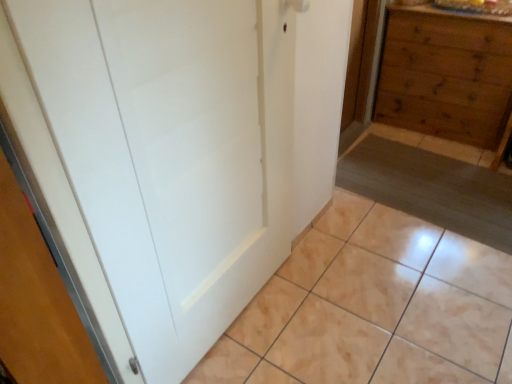
Identify the location of beige glossy tile at lower center. The height and width of the screenshot is (384, 512). (372, 307).

Consider the image. Considering the relative sizes of white matte door at center and beige glossy tile at lower center in the image provided, is white matte door at center thinner than beige glossy tile at lower center?

Indeed, white matte door at center has a lesser width compared to beige glossy tile at lower center.

Is point (197, 313) closer or farther from the camera than point (404, 229)?

Point (197, 313).

Looking at this image, is white matte door at center at the right side of beige glossy tile at lower center?

No.

Is white matte door at center oriented towards beige glossy tile at lower center?

No, white matte door at center is not aimed at beige glossy tile at lower center.

From a real-world perspective, between beige glossy tile at lower center and wooden chest of drawers at right, who is vertically lower?

beige glossy tile at lower center.

Can you confirm if beige glossy tile at lower center is taller than wooden chest of drawers at right?

In fact, beige glossy tile at lower center may be shorter than wooden chest of drawers at right.

Does beige glossy tile at lower center lie in front of wooden chest of drawers at right?

Yes, it is.

Considering the positions of objects beige glossy tile at lower center and wooden chest of drawers at right in the image provided, who is more to the right, beige glossy tile at lower center or wooden chest of drawers at right?

wooden chest of drawers at right.

How different are the orientations of beige glossy tile at lower center and white matte door at center in degrees?

beige glossy tile at lower center and white matte door at center are facing 89 degrees away from each other.

Identify the location of door that is above the beige glossy tile at lower center (from a real-world perspective). This screenshot has width=512, height=384. (174, 154).

Looking at the image, does beige glossy tile at lower center seem bigger or smaller compared to white matte door at center?

beige glossy tile at lower center is bigger than white matte door at center.

Is beige glossy tile at lower center completely or partially outside of white matte door at center?

Yes.

Considering the relative sizes of wooden chest of drawers at right and white matte door at center in the image provided, is wooden chest of drawers at right bigger than white matte door at center?

Correct, wooden chest of drawers at right is larger in size than white matte door at center.

Considering the relative sizes of wooden chest of drawers at right and white matte door at center in the image provided, is wooden chest of drawers at right thinner than white matte door at center?

No, wooden chest of drawers at right is not thinner than white matte door at center.

From their relative heights in the image, would you say wooden chest of drawers at right is taller or shorter than white matte door at center?

A: Considering their sizes, wooden chest of drawers at right has less height than white matte door at center.

Which is behind, point (455, 112) or point (270, 175)?

The point (455, 112) is behind.

From the image's perspective, is white matte door at center above or below wooden chest of drawers at right?

Based on their image positions, white matte door at center is located beneath wooden chest of drawers at right.

From the picture: From a real-world perspective, is white matte door at center on top of wooden chest of drawers at right?

Yes, from a real-world perspective, white matte door at center is above wooden chest of drawers at right.

Choose the correct answer: Is white matte door at center inside wooden chest of drawers at right or outside it?

white matte door at center is not inside wooden chest of drawers at right, it's outside.

From the image's perspective, is wooden chest of drawers at right located above or below beige glossy tile at lower center?

wooden chest of drawers at right is above beige glossy tile at lower center.

Is wooden chest of drawers at right inside the boundaries of beige glossy tile at lower center, or outside?

wooden chest of drawers at right lies outside beige glossy tile at lower center.

Is wooden chest of drawers at right next to beige glossy tile at lower center and touching it?

No, wooden chest of drawers at right is not beside beige glossy tile at lower center.

Locate an element on the screen. door that is above the beige glossy tile at lower center (from a real-world perspective) is located at coordinates (174, 154).

Find the location of a particular element. chest of drawers on the right of beige glossy tile at lower center is located at coordinates (446, 76).

Based on their spatial positions, is beige glossy tile at lower center or white matte door at center further from wooden chest of drawers at right?

white matte door at center.

Looking at the image, which one is located closer to beige glossy tile at lower center, wooden chest of drawers at right or white matte door at center?

white matte door at center.

Looking at the image, which one is located closer to beige glossy tile at lower center, white matte door at center or wooden chest of drawers at right?

Among the two, white matte door at center is located nearer to beige glossy tile at lower center.

From the image, which object appears to be nearer to wooden chest of drawers at right, white matte door at center or beige glossy tile at lower center?

beige glossy tile at lower center is positioned closer to the anchor wooden chest of drawers at right.

Which object lies further to the anchor point white matte door at center, wooden chest of drawers at right or beige glossy tile at lower center?

The object further to white matte door at center is wooden chest of drawers at right.

From the image, which object appears to be nearer to white matte door at center, beige glossy tile at lower center or wooden chest of drawers at right?

beige glossy tile at lower center is positioned closer to the anchor white matte door at center.

Find the location of a particular element. Image resolution: width=512 pixels, height=384 pixels. ceramic tile between white matte door at center and wooden chest of drawers at right along the z-axis is located at coordinates (372, 307).